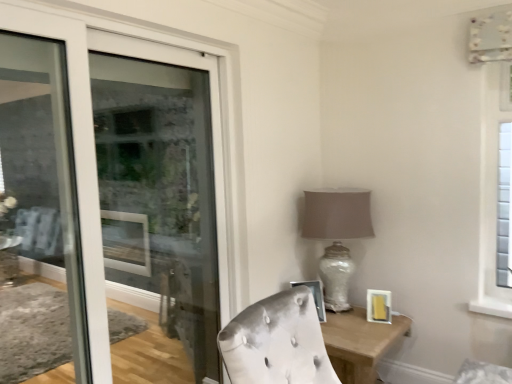
Where is `free region on the left part of matte gold picture frame at lower right, which is the 1th picture frame from right to left`? The height and width of the screenshot is (384, 512). free region on the left part of matte gold picture frame at lower right, which is the 1th picture frame from right to left is located at coordinates (346, 319).